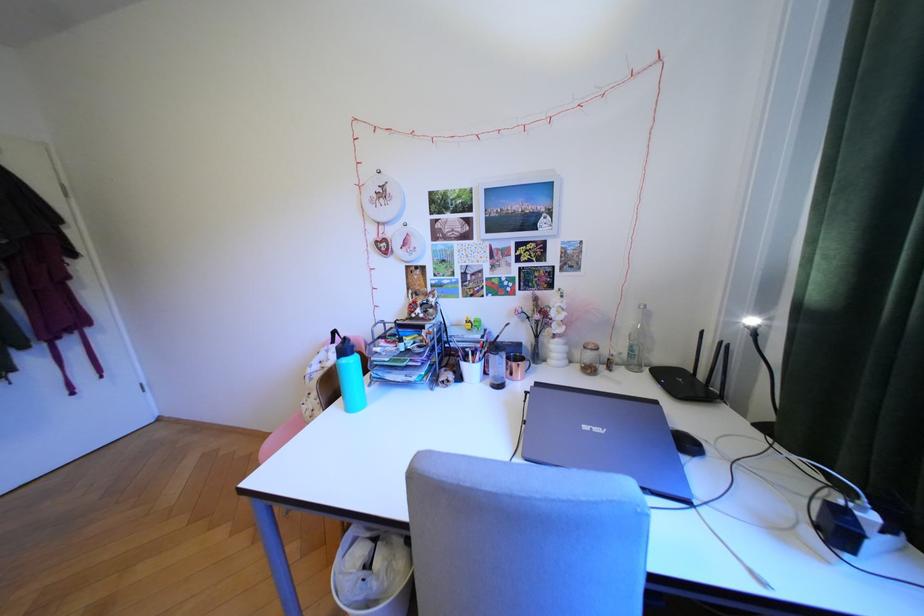
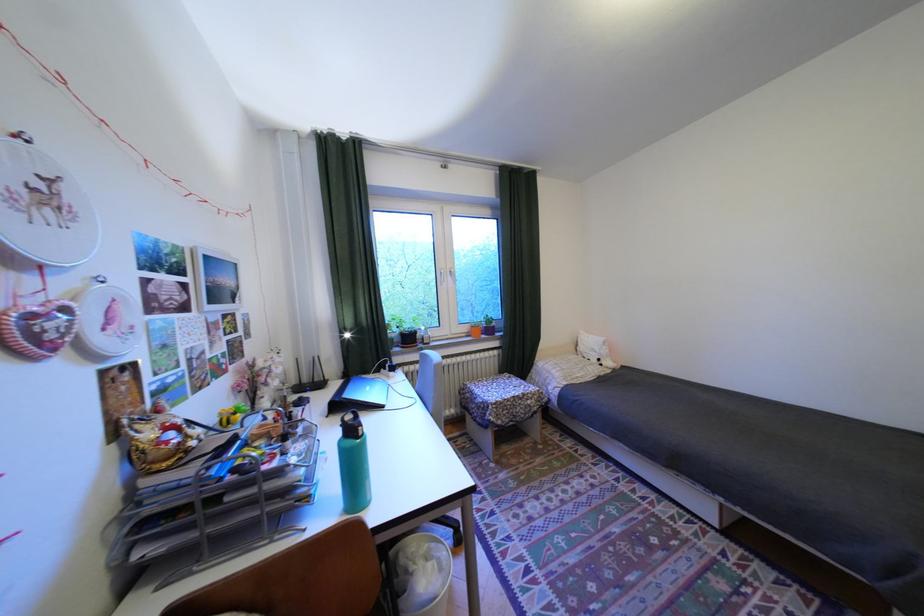
Locate, in the second image, the point that corresponds to (x=610, y=430) in the first image.

(380, 387)